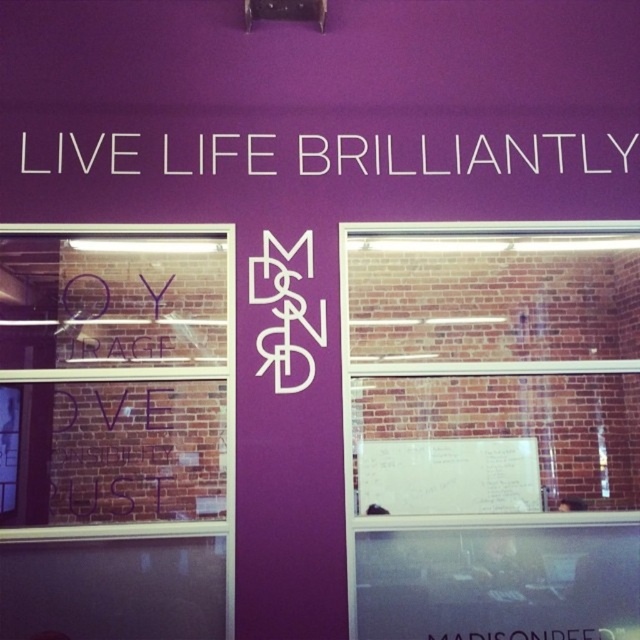
Question: Does brick wall at center appear on the left side of white text at upper center?

Choices:
 (A) yes
 (B) no

Answer: (B)

Question: Which object is farther from the camera taking this photo?

Choices:
 (A) brick wall at center
 (B) transparent glass window at left

Answer: (A)

Question: Estimate the real-world distances between objects in this image. Which object is farther from the white text at upper center?

Choices:
 (A) transparent glass window at left
 (B) brick wall at center

Answer: (A)

Question: Is brick wall at center above transparent glass window at left?

Choices:
 (A) no
 (B) yes

Answer: (B)

Question: Which object appears farthest from the camera in this image?

Choices:
 (A) transparent glass window at left
 (B) white text at upper center
 (C) brick wall at center

Answer: (B)

Question: Is brick wall at center wider than transparent glass window at left?

Choices:
 (A) no
 (B) yes

Answer: (B)